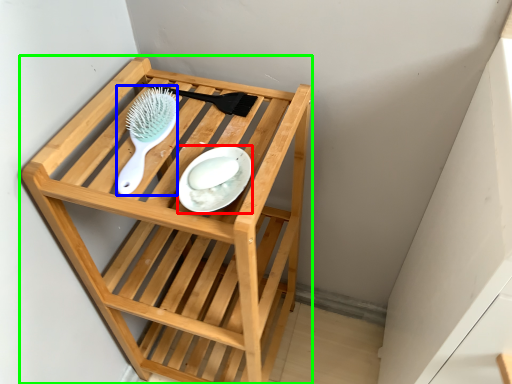
Question: Based on their relative distances, which object is farther from plate (highlighted by a red box)? Choose from brush (highlighted by a blue box) and furniture (highlighted by a green box).

Choices:
 (A) brush
 (B) furniture

Answer: (B)